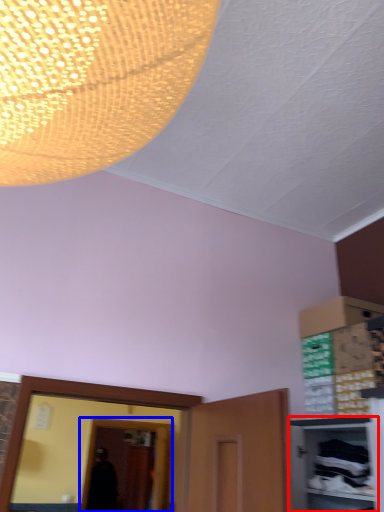
Question: Which point is closer to the camera, cabinetry (highlighted by a red box) or glass door (highlighted by a blue box)?

Choices:
 (A) cabinetry
 (B) glass door

Answer: (A)